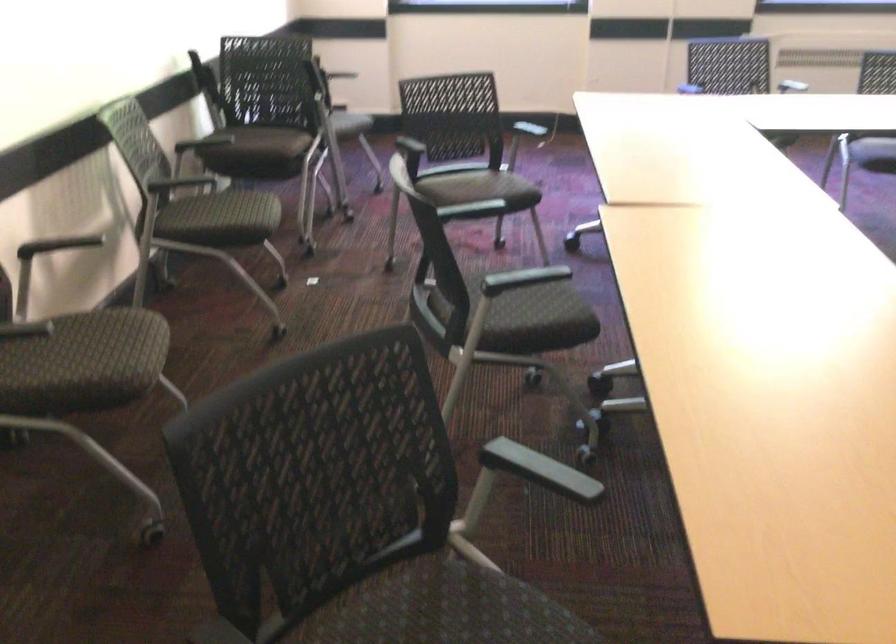
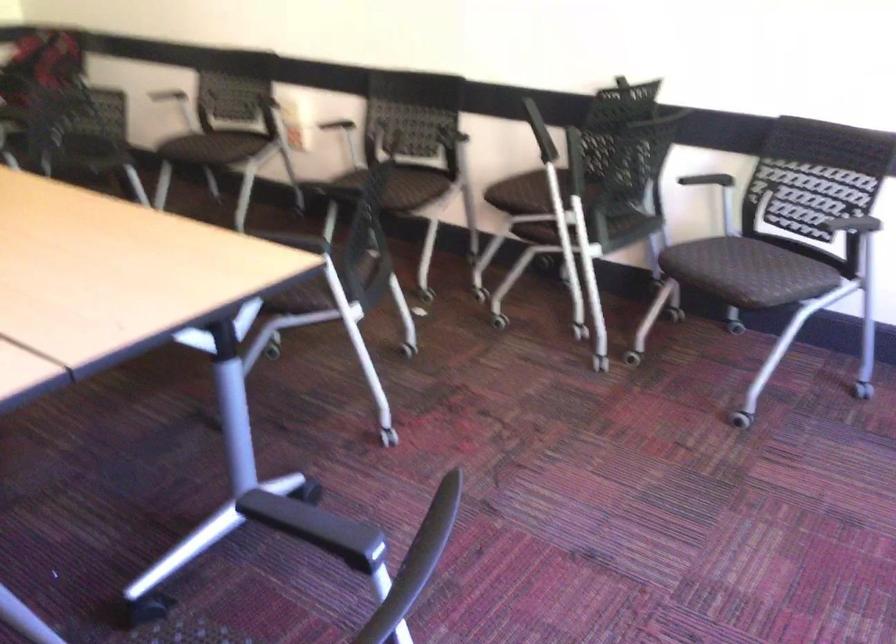
Find the pixel in the second image that matches (x=297, y=138) in the first image.

(526, 193)